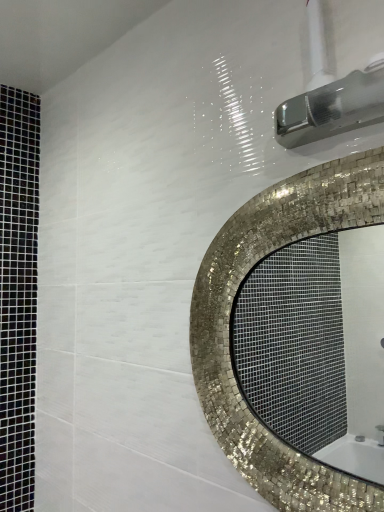
Question: From a real-world perspective, is mosaic tile mirror at center above or below brushed metal showerhead at upper right?

Choices:
 (A) below
 (B) above

Answer: (A)

Question: Is mosaic tile mirror at center inside the boundaries of brushed metal showerhead at upper right, or outside?

Choices:
 (A) outside
 (B) inside

Answer: (A)

Question: Is mosaic tile mirror at center taller or shorter than brushed metal showerhead at upper right?

Choices:
 (A) short
 (B) tall

Answer: (B)

Question: Is brushed metal showerhead at upper right wider or thinner than mosaic tile mirror at center?

Choices:
 (A) thin
 (B) wide

Answer: (B)

Question: Is brushed metal showerhead at upper right inside or outside of mosaic tile mirror at center?

Choices:
 (A) outside
 (B) inside

Answer: (A)

Question: From a real-world perspective, is brushed metal showerhead at upper right above or below mosaic tile mirror at center?

Choices:
 (A) below
 (B) above

Answer: (B)

Question: Considering the positions of brushed metal showerhead at upper right and mosaic tile mirror at center in the image, is brushed metal showerhead at upper right taller or shorter than mosaic tile mirror at center?

Choices:
 (A) tall
 (B) short

Answer: (B)